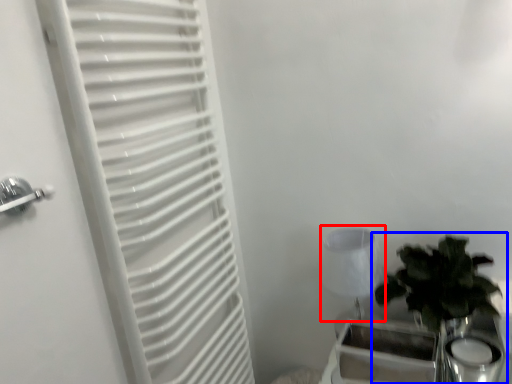
Question: Which point is further to the camera, lamp (highlighted by a red box) or houseplant (highlighted by a blue box)?

Choices:
 (A) lamp
 (B) houseplant

Answer: (A)